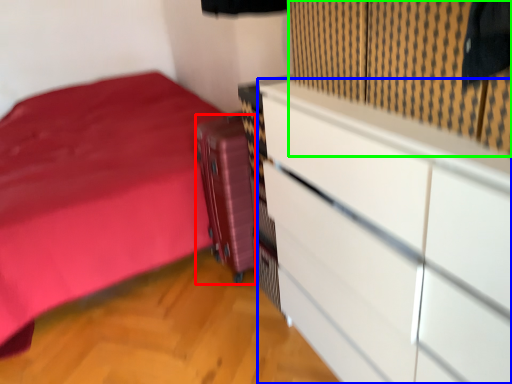
Question: Considering the real-world distances, which object is closest to luggage (highlighted by a red box)? chest of drawers (highlighted by a blue box) or curtain (highlighted by a green box).

Choices:
 (A) chest of drawers
 (B) curtain

Answer: (A)